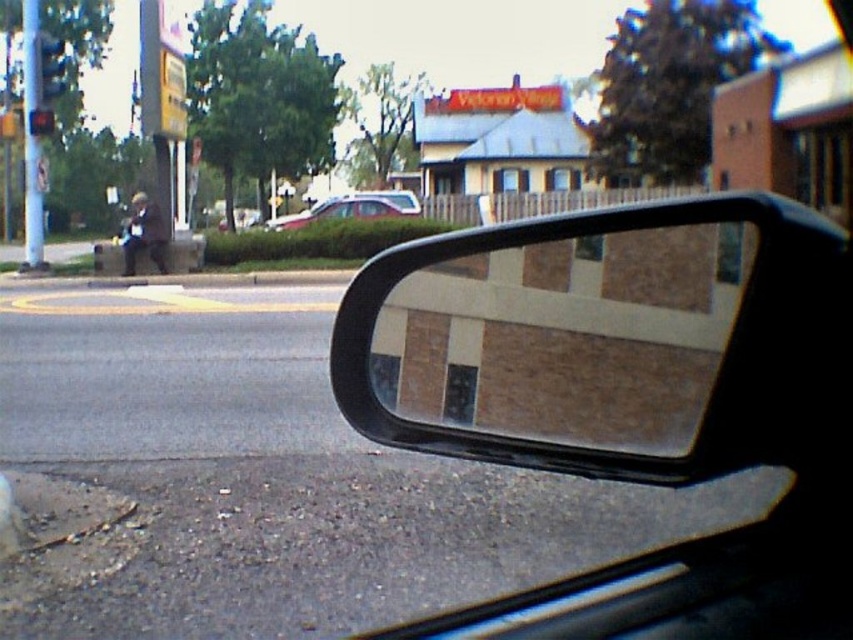
You are a driver checking your side mirror while driving a car. You notice the matte brown mirror at right and the silver metallic sedan at center in your view. Which object takes up more space in your side mirror?

The silver metallic sedan at center takes up more space in the side mirror because it is larger than the matte brown mirror at right according to the description.

You are a delivery driver who needs to make a turn onto a side street. Your vehicle has a matte brown mirror at right and a metallic traffic light at upper left in its side mirror reflection. If the distance between them in the real world is 20.02 meters, can you safely make the turn without hitting any obstacles?

The matte brown mirror at right is 20.02 meters from the metallic traffic light at upper left. Since the distance is significant, you can safely make the turn without hitting obstacles, provided you follow traffic rules and maintain control.

You are driving a car and looking at the side mirror. You need to locate the metallic blue traffic light at upper left. Where exactly is it positioned in the mirror?

The metallic blue traffic light at upper left is positioned at point (48, 68) in the mirror.